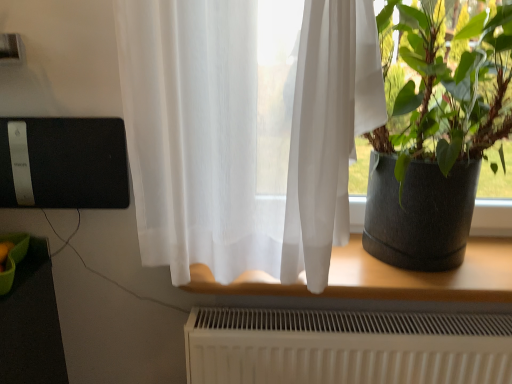
Question: Is translucent fabric at center turned away from dark gray textured pot at right?

Choices:
 (A) no
 (B) yes

Answer: (A)

Question: From the image's perspective, is translucent fabric at center under dark gray textured pot at right?

Choices:
 (A) yes
 (B) no

Answer: (A)

Question: Is translucent fabric at center positioned far away from dark gray textured pot at right?

Choices:
 (A) yes
 (B) no

Answer: (B)

Question: Considering the relative sizes of translucent fabric at center and dark gray textured pot at right in the image provided, is translucent fabric at center thinner than dark gray textured pot at right?

Choices:
 (A) yes
 (B) no

Answer: (A)

Question: Is translucent fabric at center bigger than dark gray textured pot at right?

Choices:
 (A) yes
 (B) no

Answer: (B)

Question: Is translucent fabric at center positioned before dark gray textured pot at right?

Choices:
 (A) no
 (B) yes

Answer: (A)

Question: Is dark gray textured pot at right aimed at translucent fabric at center?

Choices:
 (A) no
 (B) yes

Answer: (A)

Question: Does dark gray textured pot at right have a lesser width compared to translucent fabric at center?

Choices:
 (A) no
 (B) yes

Answer: (A)

Question: Does dark gray textured pot at right lie in front of translucent fabric at center?

Choices:
 (A) no
 (B) yes

Answer: (B)

Question: Can you see dark gray textured pot at right touching translucent fabric at center?

Choices:
 (A) no
 (B) yes

Answer: (A)

Question: Considering the relative sizes of dark gray textured pot at right and translucent fabric at center in the image provided, is dark gray textured pot at right taller than translucent fabric at center?

Choices:
 (A) yes
 (B) no

Answer: (A)

Question: Is dark gray textured pot at right shorter than translucent fabric at center?

Choices:
 (A) no
 (B) yes

Answer: (A)

Question: In the image, is translucent fabric at center on the left side or the right side of dark gray textured pot at right?

Choices:
 (A) right
 (B) left

Answer: (B)